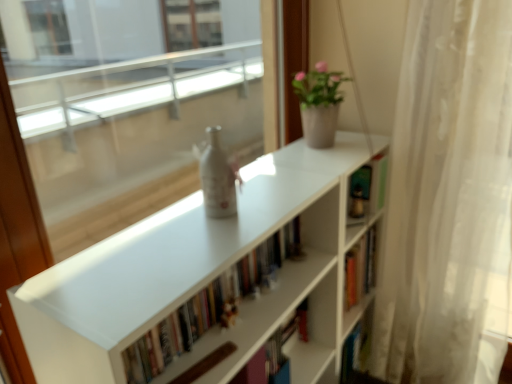
I want to click on vacant space to the left of matte white pot at upper right, so click(284, 153).